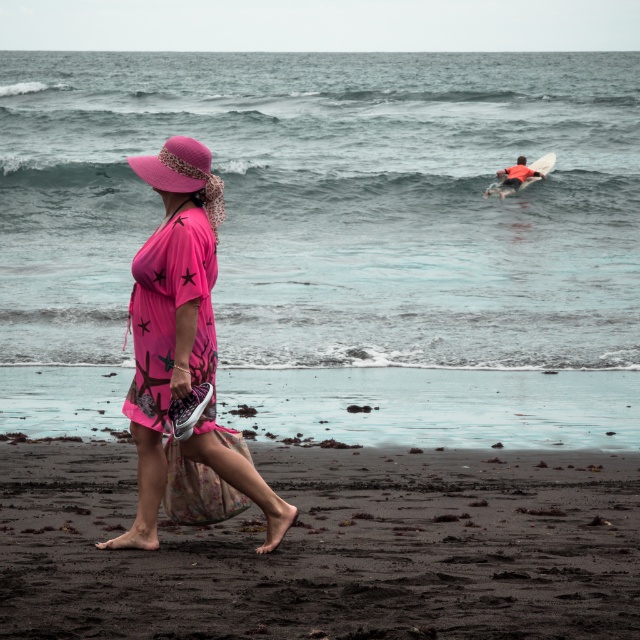
Question: Can you confirm if pink fabric hat at left is smaller than orange foam surfboard at upper right?

Choices:
 (A) no
 (B) yes

Answer: (B)

Question: Which point appears farthest from the camera in this image?

Choices:
 (A) (96, 339)
 (B) (474, 504)
 (C) (545, 161)

Answer: (C)

Question: Does dark sand at lower center come behind orange foam surfboard at upper right?

Choices:
 (A) no
 (B) yes

Answer: (A)

Question: Estimate the real-world distances between objects in this image. Which object is farther from the pink fabric hat at left?

Choices:
 (A) pink matte dress at center
 (B) dark sand at lower center
 (C) orange foam surfboard at upper right

Answer: (C)

Question: Among these points, which one is nearest to the camera?

Choices:
 (A) (353, 81)
 (B) (140, 166)
 (C) (45, 502)
 (D) (516, 172)

Answer: (B)

Question: Is clear blue water at center in front of pink fabric hat at left?

Choices:
 (A) yes
 (B) no

Answer: (B)